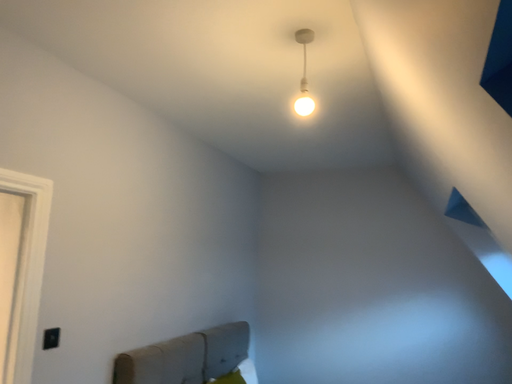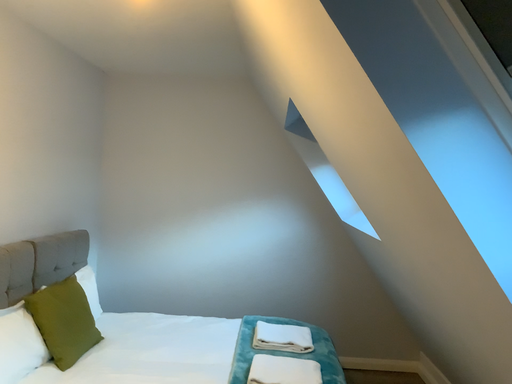
Question: How did the camera likely rotate when shooting the video?

Choices:
 (A) rotated right
 (B) rotated left

Answer: (A)